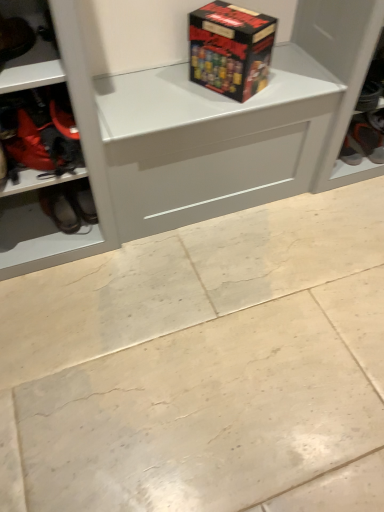
Question: Is matt black box at upper center not near orange fabric shoe at right, the 4th footwear in the left-to-right sequence?

Choices:
 (A) yes
 (B) no

Answer: (B)

Question: Is the depth of matt black box at upper center less than that of orange fabric shoe at right, which is counted as the 4th footwear, starting from the front?

Choices:
 (A) yes
 (B) no

Answer: (A)

Question: From the image's perspective, is matt black box at upper center on top of orange fabric shoe at right, the 4th footwear in the left-to-right sequence?

Choices:
 (A) yes
 (B) no

Answer: (A)

Question: Can you confirm if matt black box at upper center is bigger than orange fabric shoe at right, which ranks as the 1th footwear in right-to-left order?

Choices:
 (A) yes
 (B) no

Answer: (A)

Question: Is matt black box at upper center turned away from orange fabric shoe at right, which ranks as the 1th footwear in right-to-left order?

Choices:
 (A) no
 (B) yes

Answer: (A)

Question: From a real-world perspective, is matt black box at upper center positioned under orange fabric shoe at right, the 1th footwear when ordered from back to front, based on gravity?

Choices:
 (A) yes
 (B) no

Answer: (B)

Question: Is red fabric boot at left, acting as the 2th footwear starting from the front, to the left of orange fabric shoe at right, which ranks as the 1th footwear in right-to-left order, from the viewer's perspective?

Choices:
 (A) no
 (B) yes

Answer: (B)

Question: Is red fabric boot at left, which appears as the 3th footwear when viewed from the back, shorter than orange fabric shoe at right, the 4th footwear in the left-to-right sequence?

Choices:
 (A) no
 (B) yes

Answer: (A)

Question: From the image's perspective, is red fabric boot at left, marked as the third footwear in a left-to-right arrangement, above orange fabric shoe at right, the 1th footwear when ordered from back to front?

Choices:
 (A) no
 (B) yes

Answer: (A)

Question: From the image's perspective, does red fabric boot at left, acting as the 2th footwear starting from the front, appear lower than orange fabric shoe at right, which ranks as the 1th footwear in right-to-left order?

Choices:
 (A) yes
 (B) no

Answer: (A)

Question: Considering the relative sizes of red fabric boot at left, which appears as the 3th footwear when viewed from the back, and orange fabric shoe at right, which is counted as the 4th footwear, starting from the front, in the image provided, is red fabric boot at left, which appears as the 3th footwear when viewed from the back, smaller than orange fabric shoe at right, which is counted as the 4th footwear, starting from the front,?

Choices:
 (A) no
 (B) yes

Answer: (A)

Question: Considering the relative positions of red fabric boot at left, which appears as the 3th footwear when viewed from the back, and orange fabric shoe at right, which is counted as the 4th footwear, starting from the front, in the image provided, is red fabric boot at left, which appears as the 3th footwear when viewed from the back, behind orange fabric shoe at right, which is counted as the 4th footwear, starting from the front,?

Choices:
 (A) no
 (B) yes

Answer: (A)

Question: From a real-world perspective, is beige marble floor at center beneath matte black shoe at left, which is the 4th footwear from right to left?

Choices:
 (A) no
 (B) yes

Answer: (B)